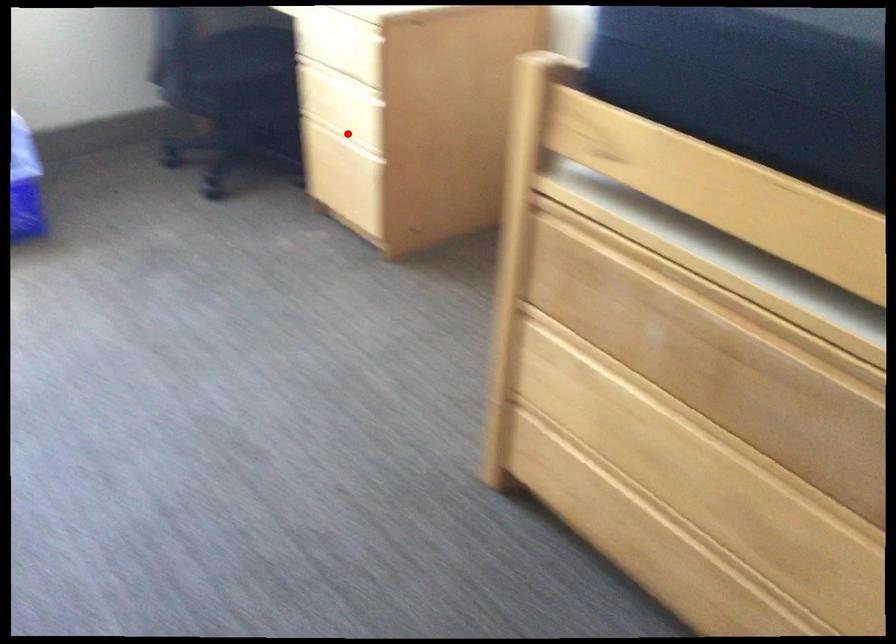
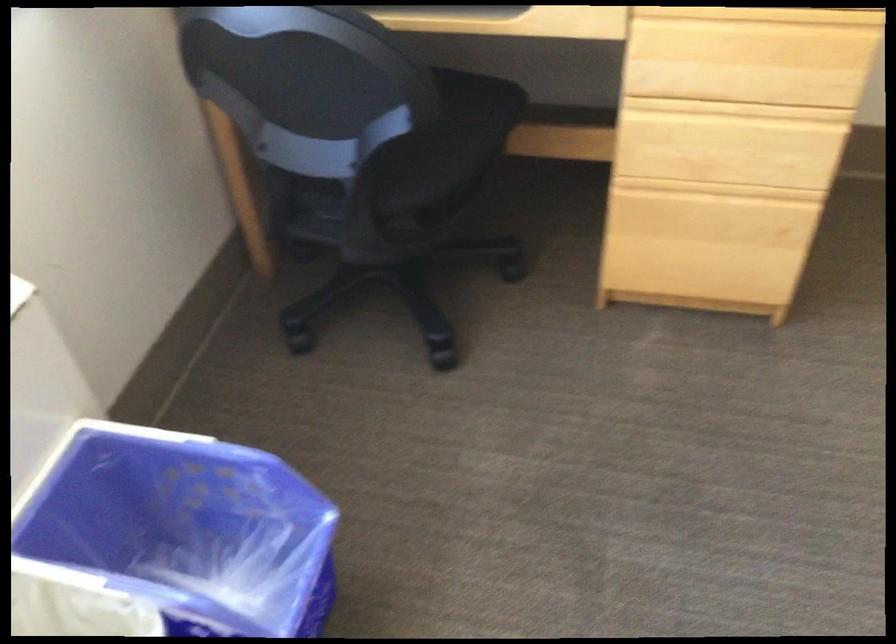
Question: A red point is marked in image1. In image2, is the corresponding 3D point closer to the camera or farther? Reply with the corresponding letter.

Choices:
 (A) The corresponding 3D point is closer.
 (B) The corresponding 3D point is farther.

Answer: (A)